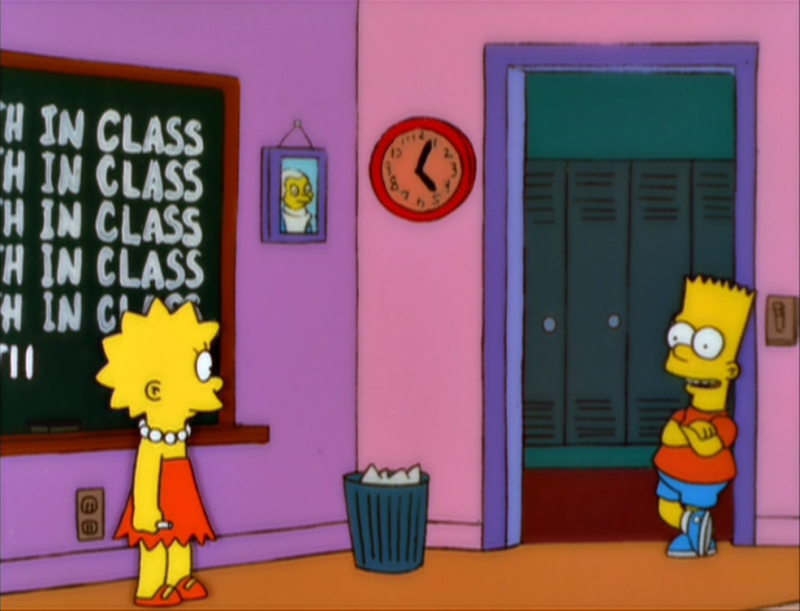
Find the location of `trash can`. trash can is located at coordinates (382, 499).